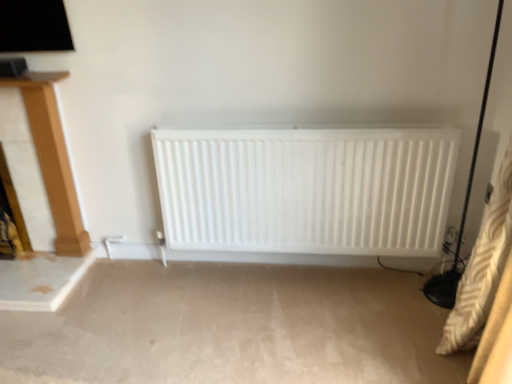
Find the location of a particular element. The image size is (512, 384). vacant area that is in front of wooden fireplace at left is located at coordinates (56, 265).